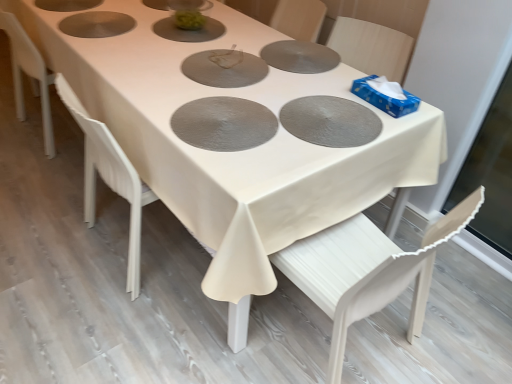
The height and width of the screenshot is (384, 512). What do you see at coordinates (225, 68) in the screenshot?
I see `matte gray pizza pan at center, which ranks as the third pizza pan in bottom-to-top order` at bounding box center [225, 68].

Measure the distance between point [234,68] and camera.

5.63 feet.

Image resolution: width=512 pixels, height=384 pixels. Describe the element at coordinates (224, 124) in the screenshot. I see `textured silver pizza pan at center, arranged as the first pizza pan when ordered from the bottom` at that location.

You are a GUI agent. You are given a task and a screenshot of the screen. Output one action in this format:
    pyautogui.click(x=<x>, y=<y>)
    Task: Click on the white wood chair at lower right
    The width and height of the screenshot is (512, 384).
    Given the screenshot: What is the action you would take?
    pyautogui.click(x=367, y=271)

The height and width of the screenshot is (384, 512). I want to click on pizza pan that appears on the left of textured silver pizza pan at center, arranged as the first pizza pan when ordered from the bottom, so click(x=225, y=68).

Could you tell me if textured silver pizza pan at center, arranged as the first pizza pan when ordered from the bottom, is facing matte gray pizza pan at center, which ranks as the third pizza pan in bottom-to-top order?

No, textured silver pizza pan at center, arranged as the first pizza pan when ordered from the bottom, is not facing towards matte gray pizza pan at center, which ranks as the third pizza pan in bottom-to-top order.

Can you confirm if textured silver pizza pan at center, which is counted as the third pizza pan, starting from the top, is taller than matte gray pizza pan at center, which ranks as the third pizza pan in bottom-to-top order?

No.

From a real-world perspective, is textured silver pizza pan at center, arranged as the first pizza pan when ordered from the bottom, positioned under matte gray pizza pan at center, which ranks as the third pizza pan in bottom-to-top order, based on gravity?

No.

Looking at the image, does textured silver pizza pan at center, which is counted as the third pizza pan, starting from the top, seem bigger or smaller compared to matte gray pizza pan at center, which is the second pizza pan in bottom-to-top order?

textured silver pizza pan at center, which is counted as the third pizza pan, starting from the top, is bigger than matte gray pizza pan at center, which is the second pizza pan in bottom-to-top order.

Looking at this image, considering the positions of objects textured silver pizza pan at center, which is counted as the third pizza pan, starting from the top, and matte gray pizza pan at center, which is the 2th pizza pan from top to bottom, in the image provided, who is more to the left, textured silver pizza pan at center, which is counted as the third pizza pan, starting from the top, or matte gray pizza pan at center, which is the 2th pizza pan from top to bottom,?

textured silver pizza pan at center, which is counted as the third pizza pan, starting from the top, is more to the left.

Could you tell me if textured silver pizza pan at center, which is counted as the third pizza pan, starting from the top, is facing matte gray pizza pan at center, which is the 2th pizza pan from top to bottom?

No, textured silver pizza pan at center, which is counted as the third pizza pan, starting from the top, does not turn towards matte gray pizza pan at center, which is the 2th pizza pan from top to bottom.

Between textured silver pizza pan at center, arranged as the first pizza pan when ordered from the bottom, and matte gray pizza pan at center, which is the second pizza pan in bottom-to-top order, which one has larger width?

textured silver pizza pan at center, arranged as the first pizza pan when ordered from the bottom.

How far apart are matte gray pizza pan at center, which ranks as the third pizza pan in bottom-to-top order, and matte gray pizza pan at center, which is the second pizza pan in bottom-to-top order?

matte gray pizza pan at center, which ranks as the third pizza pan in bottom-to-top order, is 37.81 centimeters from matte gray pizza pan at center, which is the second pizza pan in bottom-to-top order.

Considering the relative sizes of matte gray pizza pan at center, which ranks as the third pizza pan in bottom-to-top order, and matte gray pizza pan at center, which is the 2th pizza pan from top to bottom, in the image provided, is matte gray pizza pan at center, which ranks as the third pizza pan in bottom-to-top order, smaller than matte gray pizza pan at center, which is the 2th pizza pan from top to bottom,?

No, matte gray pizza pan at center, which ranks as the third pizza pan in bottom-to-top order, is not smaller than matte gray pizza pan at center, which is the 2th pizza pan from top to bottom.

Is matte gray pizza pan at center, which ranks as the 1th pizza pan in top-to-bottom order, far from matte gray pizza pan at center, which is the 2th pizza pan from top to bottom?

matte gray pizza pan at center, which ranks as the 1th pizza pan in top-to-bottom order, is actually quite close to matte gray pizza pan at center, which is the 2th pizza pan from top to bottom.

Is matte gray pizza pan at center, which ranks as the third pizza pan in bottom-to-top order, aimed at matte gray pizza pan at center, which is the second pizza pan in bottom-to-top order?

No, matte gray pizza pan at center, which ranks as the third pizza pan in bottom-to-top order, is not aimed at matte gray pizza pan at center, which is the second pizza pan in bottom-to-top order.

Based on the photo, which object is positioned more to the right, white wood chair at lower right or textured silver pizza pan at center, arranged as the first pizza pan when ordered from the bottom?

white wood chair at lower right is more to the right.

Choose the correct answer: Is white wood chair at lower right inside textured silver pizza pan at center, which is counted as the third pizza pan, starting from the top, or outside it?

white wood chair at lower right is not enclosed by textured silver pizza pan at center, which is counted as the third pizza pan, starting from the top.

Is point (336, 235) more distant than point (218, 100)?

Yes.

What's the angular difference between white wood chair at lower right and textured silver pizza pan at center, which is counted as the third pizza pan, starting from the top,'s facing directions?

The angle between the facing direction of white wood chair at lower right and the facing direction of textured silver pizza pan at center, which is counted as the third pizza pan, starting from the top, is 90.6 degrees.

Does matte gray pizza pan at center, which ranks as the third pizza pan in bottom-to-top order, have a lesser height compared to white wood chair at lower right?

Yes.

From a real-world perspective, relative to white wood chair at lower right, is matte gray pizza pan at center, which ranks as the 1th pizza pan in top-to-bottom order, vertically above or below?

matte gray pizza pan at center, which ranks as the 1th pizza pan in top-to-bottom order, is above white wood chair at lower right.

Between matte gray pizza pan at center, which ranks as the third pizza pan in bottom-to-top order, and white wood chair at lower right, which one has larger width?

white wood chair at lower right.

Is matte gray pizza pan at center, which ranks as the third pizza pan in bottom-to-top order, positioned far away from white wood chair at lower right?

No, there isn't a large distance between matte gray pizza pan at center, which ranks as the third pizza pan in bottom-to-top order, and white wood chair at lower right.

Is the surface of white wood chair at lower right in direct contact with matte gray pizza pan at center, which ranks as the third pizza pan in bottom-to-top order?

No, white wood chair at lower right is not beside matte gray pizza pan at center, which ranks as the third pizza pan in bottom-to-top order.

Does white wood chair at lower right turn towards matte gray pizza pan at center, which ranks as the third pizza pan in bottom-to-top order?

Yes.

From a real-world perspective, which object rests below the other?

white wood chair at lower right.

Is white wood chair at lower right further to camera compared to matte gray pizza pan at center, which ranks as the third pizza pan in bottom-to-top order?

That is False.

Does matte gray pizza pan at center, which is the 2th pizza pan from top to bottom, lie in front of matte gray pizza pan at center, which ranks as the third pizza pan in bottom-to-top order?

Yes, matte gray pizza pan at center, which is the 2th pizza pan from top to bottom, is closer to the viewer.

Does point (327, 105) lie behind point (216, 82)?

No, (327, 105) is closer to viewer.

From the image's perspective, does matte gray pizza pan at center, which is the second pizza pan in bottom-to-top order, appear lower than matte gray pizza pan at center, which ranks as the third pizza pan in bottom-to-top order?

Yes.

Can you confirm if matte gray pizza pan at center, which is the second pizza pan in bottom-to-top order, is thinner than matte gray pizza pan at center, which ranks as the third pizza pan in bottom-to-top order?

Yes, matte gray pizza pan at center, which is the second pizza pan in bottom-to-top order, is thinner than matte gray pizza pan at center, which ranks as the third pizza pan in bottom-to-top order.

At what (x,y) coordinates should I click in order to perform the action: click on the 2nd pizza pan below the matte gray pizza pan at center, which ranks as the 1th pizza pan in top-to-bottom order (from the image's perspective). Please return your answer as a coordinate pair (x, y). Looking at the image, I should click on (224, 124).

You are a GUI agent. You are given a task and a screenshot of the screen. Output one action in this format:
    pyautogui.click(x=<x>, y=<y>)
    Task: Click on the 1st pizza pan to the left of the matte gray pizza pan at center, which is the 2th pizza pan from top to bottom, starting your count from the anchor
    
    Given the screenshot: What is the action you would take?
    pyautogui.click(x=224, y=124)

From the image, which object appears to be nearer to white wood chair at lower right, textured silver pizza pan at center, which is counted as the third pizza pan, starting from the top, or matte gray pizza pan at center, which is the second pizza pan in bottom-to-top order?

matte gray pizza pan at center, which is the second pizza pan in bottom-to-top order, lies closer to white wood chair at lower right than the other object.

When comparing their distances from matte gray pizza pan at center, which ranks as the third pizza pan in bottom-to-top order, does textured silver pizza pan at center, which is counted as the third pizza pan, starting from the top, or matte gray pizza pan at center, which is the 2th pizza pan from top to bottom, seem further?

Based on the image, matte gray pizza pan at center, which is the 2th pizza pan from top to bottom, appears to be further to matte gray pizza pan at center, which ranks as the third pizza pan in bottom-to-top order.

Looking at the image, which one is located further to textured silver pizza pan at center, arranged as the first pizza pan when ordered from the bottom, matte gray pizza pan at center, which is the 2th pizza pan from top to bottom, or matte gray pizza pan at center, which ranks as the 1th pizza pan in top-to-bottom order?

Based on the image, matte gray pizza pan at center, which ranks as the 1th pizza pan in top-to-bottom order, appears to be further to textured silver pizza pan at center, arranged as the first pizza pan when ordered from the bottom.

Looking at the image, which one is located closer to textured silver pizza pan at center, which is counted as the third pizza pan, starting from the top, matte gray pizza pan at center, which ranks as the third pizza pan in bottom-to-top order, or white wood chair at lower right?

The object closer to textured silver pizza pan at center, which is counted as the third pizza pan, starting from the top, is matte gray pizza pan at center, which ranks as the third pizza pan in bottom-to-top order.

Looking at the image, which one is located closer to white wood chair at lower right, textured silver pizza pan at center, arranged as the first pizza pan when ordered from the bottom, or matte gray pizza pan at center, which ranks as the 1th pizza pan in top-to-bottom order?

textured silver pizza pan at center, arranged as the first pizza pan when ordered from the bottom, is closer to white wood chair at lower right.

Which object lies nearer to the anchor point matte gray pizza pan at center, which is the 2th pizza pan from top to bottom, white wood chair at lower right or textured silver pizza pan at center, arranged as the first pizza pan when ordered from the bottom?

Based on the image, textured silver pizza pan at center, arranged as the first pizza pan when ordered from the bottom, appears to be nearer to matte gray pizza pan at center, which is the 2th pizza pan from top to bottom.

When comparing their distances from matte gray pizza pan at center, which is the 2th pizza pan from top to bottom, does textured silver pizza pan at center, which is counted as the third pizza pan, starting from the top, or matte gray pizza pan at center, which ranks as the third pizza pan in bottom-to-top order, seem closer?

Based on the image, textured silver pizza pan at center, which is counted as the third pizza pan, starting from the top, appears to be nearer to matte gray pizza pan at center, which is the 2th pizza pan from top to bottom.

Considering their positions, is matte gray pizza pan at center, which is the 2th pizza pan from top to bottom, positioned further to matte gray pizza pan at center, which ranks as the 1th pizza pan in top-to-bottom order, than white wood chair at lower right?

The object further to matte gray pizza pan at center, which ranks as the 1th pizza pan in top-to-bottom order, is white wood chair at lower right.

Identify the location of pizza pan between matte gray pizza pan at center, which ranks as the 1th pizza pan in top-to-bottom order, and matte gray pizza pan at center, which is the 2th pizza pan from top to bottom. (224, 124).

Identify the location of pizza pan between matte gray pizza pan at center, which is the second pizza pan in bottom-to-top order, and white wood chair at lower right, in the vertical direction. (224, 124).